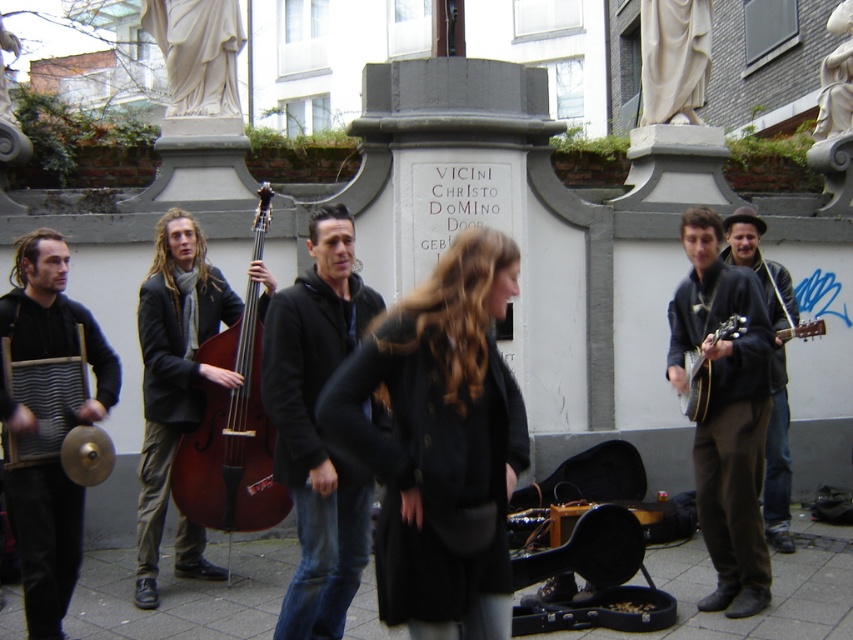
Question: Among these objects, which one is nearest to the camera?

Choices:
 (A) black matte jacket at center
 (B) shiny black guitar at right
 (C) mahogany wood cello at center
 (D) matte black washboard at left

Answer: (A)

Question: Based on their relative distances, which object is nearer to the black matte jacket at center?

Choices:
 (A) matte black washboard at left
 (B) mahogany wood cello at center
 (C) brown leather jacket at right
 (D) shiny black guitar at right

Answer: (B)

Question: In this image, where is mahogany wood cello at center located relative to shiny black guitar at right?

Choices:
 (A) below
 (B) above

Answer: (B)

Question: Is mahogany wood cello at center wider than shiny black guitar at right?

Choices:
 (A) yes
 (B) no

Answer: (A)

Question: Is black matte jacket at center to the left of shiny black guitar at right from the viewer's perspective?

Choices:
 (A) no
 (B) yes

Answer: (B)

Question: Estimate the real-world distances between objects in this image. Which object is closer to the matte black washboard at left?

Choices:
 (A) black matte jacket at center
 (B) shiny black guitar at right
 (C) dark brown leather jacket at right
 (D) mahogany wood cello at center

Answer: (D)